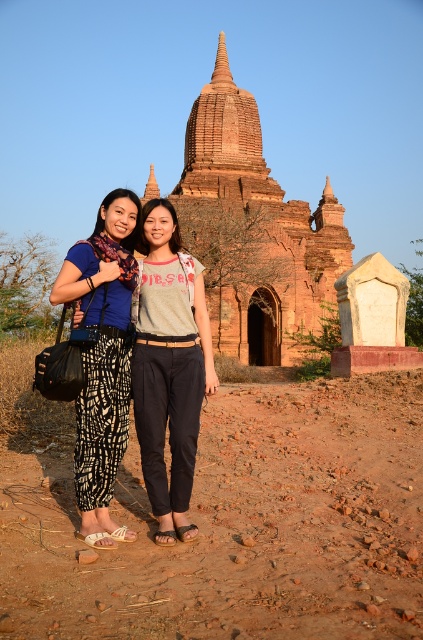
You are a photographer planning to capture a wide shot of the rustic brick temple at center and the printed fabric pants at center. Based on their relative sizes in the image, which object would likely occupy more of the frame?

The rustic brick temple at center might be wider than printed fabric pants at center, so it would likely occupy more of the frame.

You are a photographer trying to capture both the rustic brick temple at center and the printed fabric pants at center in a single frame. Based on their sizes, which object should you focus on first to ensure both are clearly visible in your photo?

The rustic brick temple at center is bigger than the printed fabric pants at center, so you should focus on the rustic brick temple at center first to ensure both are clearly visible in your photo.